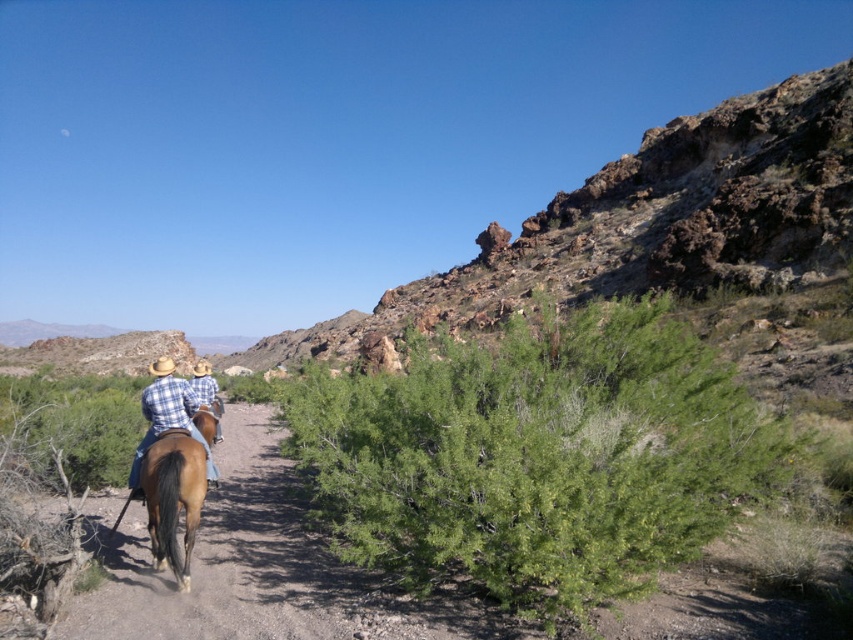
Locate an element on the screen. Image resolution: width=853 pixels, height=640 pixels. green leafy bush at center is located at coordinates (540, 456).

Can you confirm if green leafy bush at center is bigger than plaid fabric shirt at center-left?

Indeed, green leafy bush at center has a larger size compared to plaid fabric shirt at center-left.

Describe the element at coordinates (540, 456) in the screenshot. I see `green leafy bush at center` at that location.

You are a GUI agent. You are given a task and a screenshot of the screen. Output one action in this format:
    pyautogui.click(x=<x>, y=<y>)
    Task: Click on the green leafy bush at center
    
    Given the screenshot: What is the action you would take?
    pyautogui.click(x=540, y=456)

How distant is brown glossy horse at center from plaid fabric shirt at center-left?

brown glossy horse at center is 3.39 feet from plaid fabric shirt at center-left.

Is point (171, 499) less distant than point (173, 388)?

Yes, point (171, 499) is closer to viewer.

At what (x,y) coordinates should I click in order to perform the action: click on brown glossy horse at center. Please return your answer as a coordinate pair (x, y). Looking at the image, I should click on (173, 499).

Is the position of green leafy bush at center less distant than that of blue plaid shirt at center?

Yes, green leafy bush at center is in front of blue plaid shirt at center.

Is point (640, 593) closer to viewer compared to point (207, 365)?

That is True.

The height and width of the screenshot is (640, 853). What do you see at coordinates (540, 456) in the screenshot? I see `green leafy bush at center` at bounding box center [540, 456].

The width and height of the screenshot is (853, 640). What are the coordinates of `green leafy bush at center` in the screenshot? It's located at (540, 456).